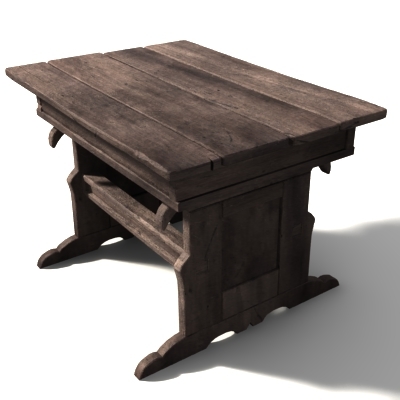
The image size is (400, 400). What are the coordinates of `shadow underneath table` in the screenshot? It's located at (116, 255).